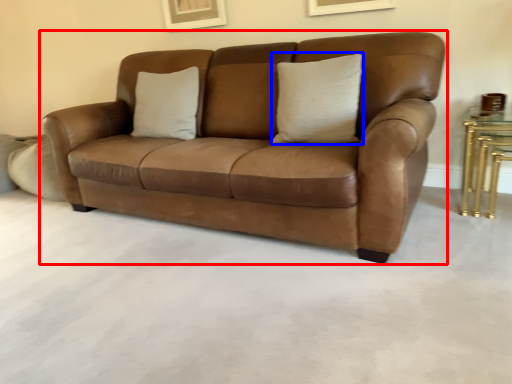
Question: Which point is further to the camera, studio couch (highlighted by a red box) or pillow (highlighted by a blue box)?

Choices:
 (A) studio couch
 (B) pillow

Answer: (B)